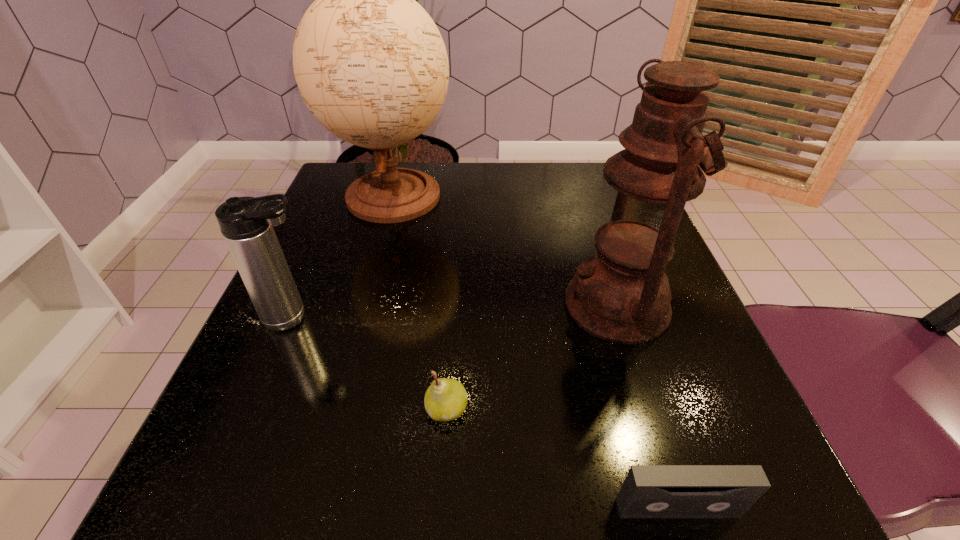
This screenshot has width=960, height=540. What are the coordinates of `free space that satisfies the following two spatial constraints: 1. on the surface of the pear; 2. on the left side of the farthest object` in the screenshot? It's located at (336, 409).

I want to click on vacant space that satisfies the following two spatial constraints: 1. on the handle side of the thermos bottle; 2. on the right side of the fourth farthest object, so click(256, 409).